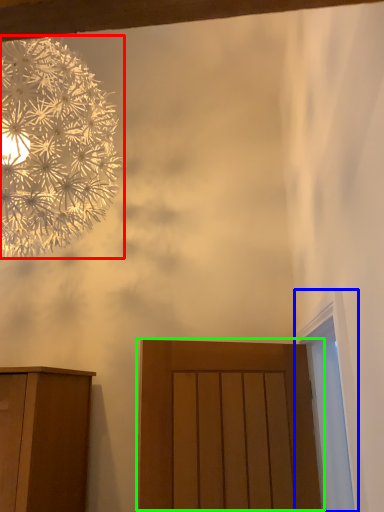
Question: Estimate the real-world distances between objects in this image. Which object is farther from flower (highlighted by a red box), window (highlighted by a blue box) or door (highlighted by a green box)?

Choices:
 (A) window
 (B) door

Answer: (A)